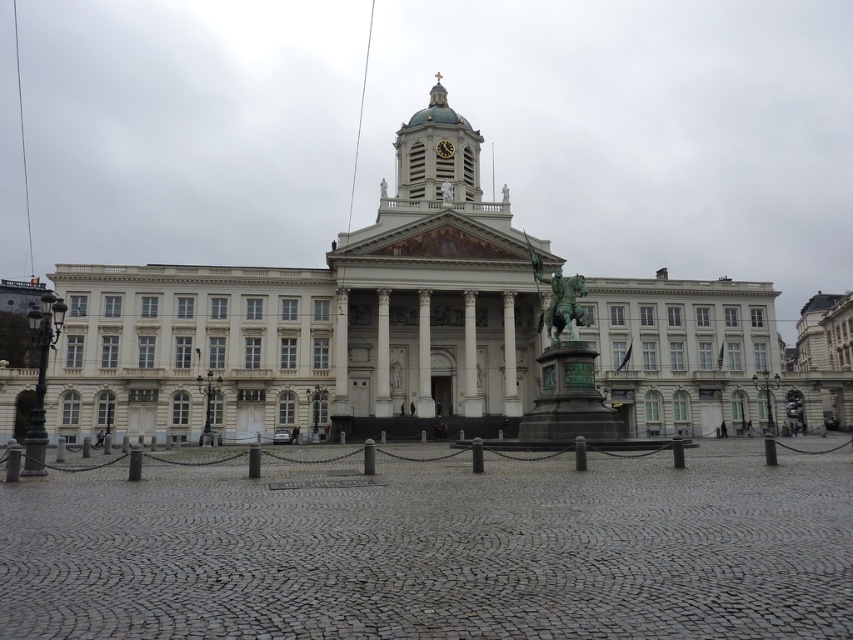
Question: Which of the following is the farthest from the observer?

Choices:
 (A) bronze statue at center
 (B) silver metallic dome at center

Answer: (B)

Question: Is white marble tower at center to the left of gold metallic clock at center from the viewer's perspective?

Choices:
 (A) no
 (B) yes

Answer: (B)

Question: Among these points, which one is nearest to the camera?

Choices:
 (A) (439, 88)
 (B) (546, 333)

Answer: (B)

Question: Does green patina bronze statue at center appear over bronze statue at center?

Choices:
 (A) yes
 (B) no

Answer: (B)

Question: Does white marble palace at center appear over silver metallic dome at center?

Choices:
 (A) yes
 (B) no

Answer: (B)

Question: Considering the real-world distances, which object is farthest from the gold metallic clock at center?

Choices:
 (A) bronze statue at center
 (B) white marble palace at center
 (C) white marble tower at center

Answer: (B)